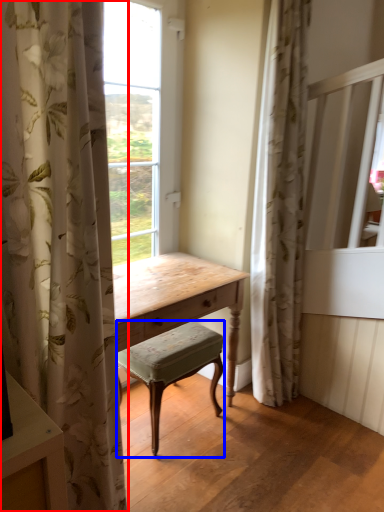
Question: Which of the following is the closest to the observer, curtain (highlighted by a red box) or stool (highlighted by a blue box)?

Choices:
 (A) curtain
 (B) stool

Answer: (A)